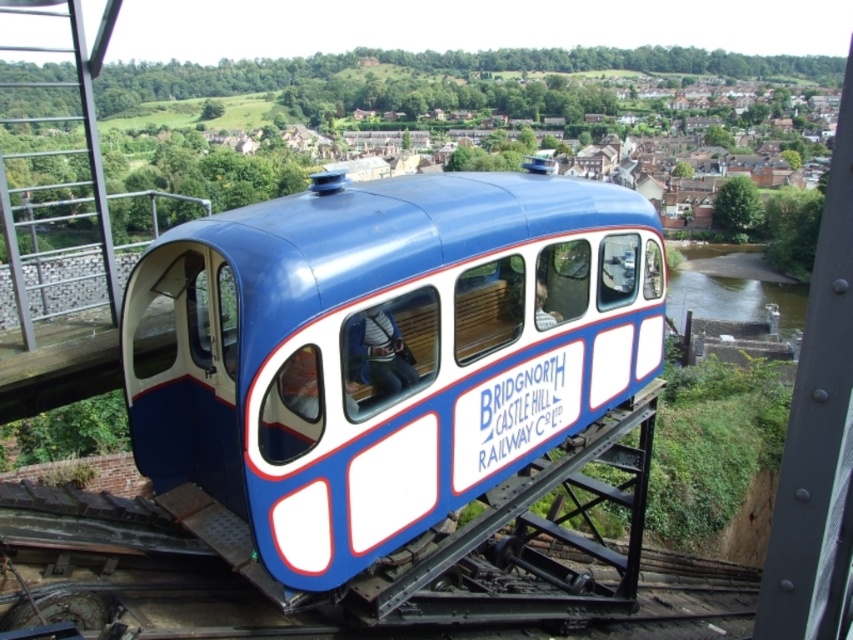
Is blue glossy train car at center taller than matte blue coach at center?

Correct, blue glossy train car at center is much taller as matte blue coach at center.

Can you confirm if blue glossy train car at center is wider than matte blue coach at center?

Correct, the width of blue glossy train car at center exceeds that of matte blue coach at center.

Between point (381, 236) and point (389, 324), which one is positioned behind?

The point (389, 324) is behind.

At what (x,y) coordinates should I click in order to perform the action: click on blue glossy train car at center. Please return your answer as a coordinate pair (x, y). Image resolution: width=853 pixels, height=640 pixels. Looking at the image, I should click on (404, 388).

Based on the photo, between green smooth water at lower right and matte blue coach at center, which one has more height?

green smooth water at lower right

The image size is (853, 640). What do you see at coordinates (732, 285) in the screenshot?
I see `green smooth water at lower right` at bounding box center [732, 285].

This screenshot has height=640, width=853. Identify the location of green smooth water at lower right. click(x=732, y=285).

Is blue glossy train car at center thinner than green smooth water at lower right?

Yes, blue glossy train car at center is thinner than green smooth water at lower right.

Can you confirm if blue glossy train car at center is bigger than green smooth water at lower right?

Actually, blue glossy train car at center might be smaller than green smooth water at lower right.

What do you see at coordinates (404, 388) in the screenshot?
I see `blue glossy train car at center` at bounding box center [404, 388].

The height and width of the screenshot is (640, 853). In order to click on blue glossy train car at center in this screenshot , I will do `click(404, 388)`.